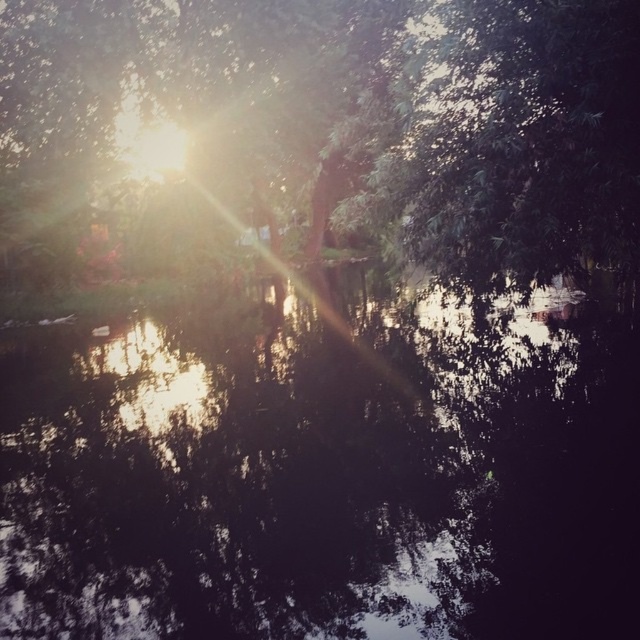
Question: From the image, what is the correct spatial relationship of black reflective water at center in relation to green leafy tree at upper center?

Choices:
 (A) above
 (B) below

Answer: (B)

Question: Is black reflective water at center positioned at the back of green leafy tree at upper center?

Choices:
 (A) yes
 (B) no

Answer: (B)

Question: Which point is closer to the camera?

Choices:
 (A) (336, 340)
 (B) (240, 35)

Answer: (A)

Question: Can you confirm if black reflective water at center is positioned below green leafy tree at upper center?

Choices:
 (A) yes
 (B) no

Answer: (A)